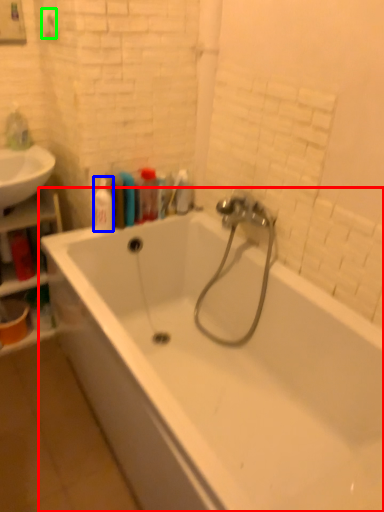
Question: Based on their relative distances, which object is nearer to bathtub (highlighted by a red box)? Choose from toiletry (highlighted by a blue box) and towel bar (highlighted by a green box).

Choices:
 (A) toiletry
 (B) towel bar

Answer: (A)